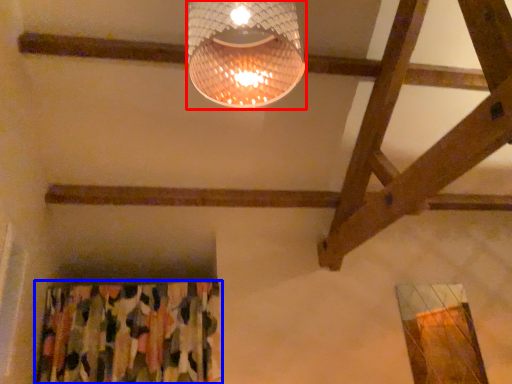
Question: Among these objects, which one is farthest to the camera, lamp (highlighted by a red box) or curtain (highlighted by a blue box)?

Choices:
 (A) lamp
 (B) curtain

Answer: (B)